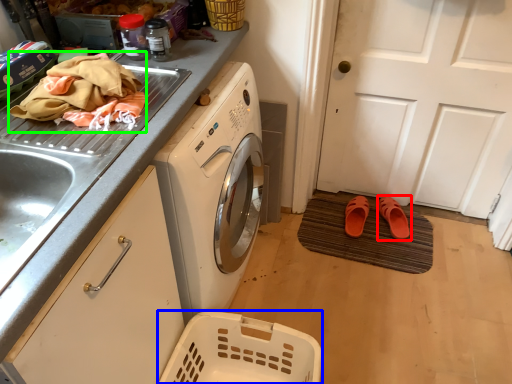
Question: Estimate the real-world distances between objects in this image. Which object is farther from footwear (highlighted by a red box), basket (highlighted by a blue box) or material (highlighted by a green box)?

Choices:
 (A) basket
 (B) material

Answer: (B)